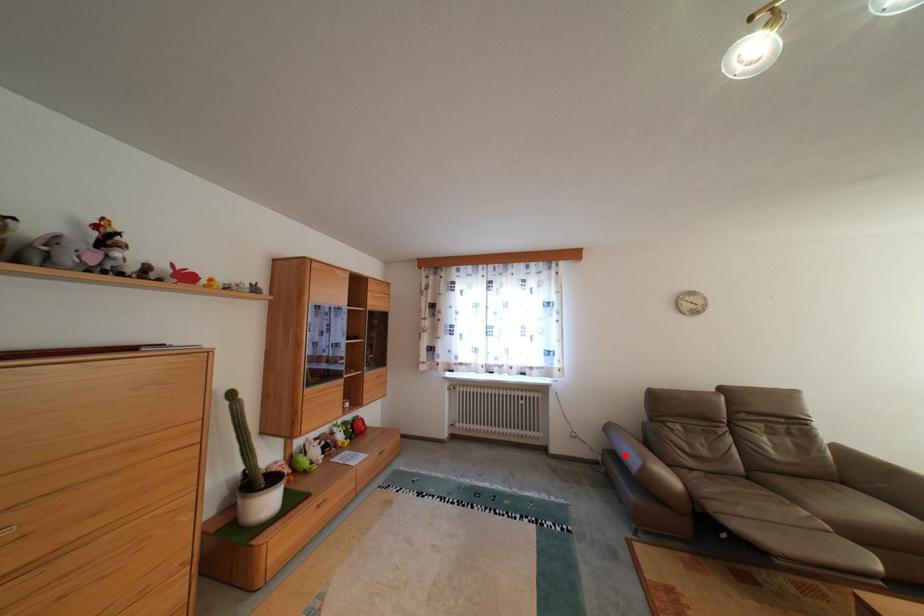
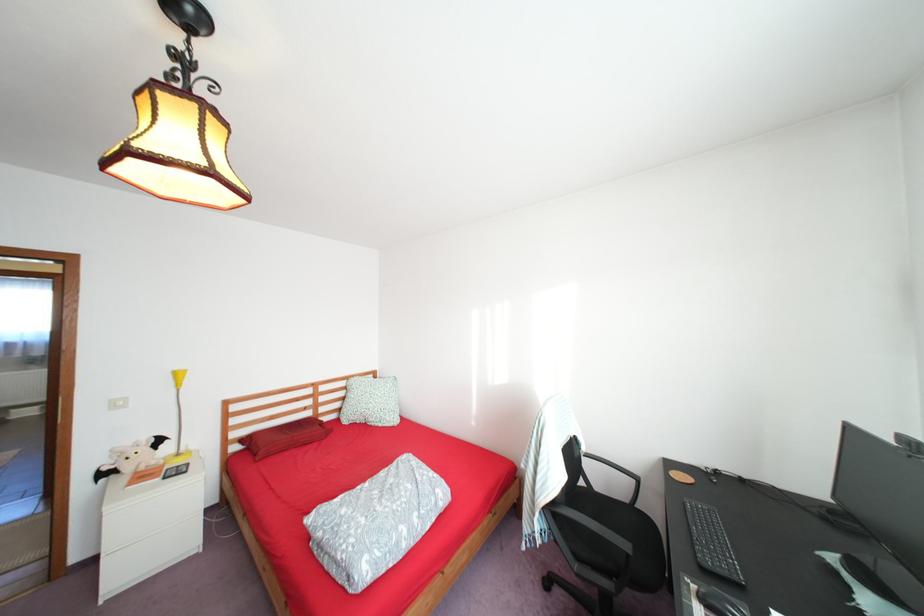
Question: I am providing you with two images of the same scene from different viewpoints. A red point is marked on the first image. At the location where the point appears in image 1, is it still visible in image 2?

Choices:
 (A) Yes
 (B) No

Answer: (B)